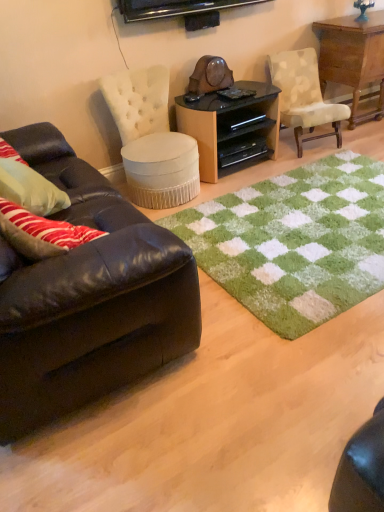
The width and height of the screenshot is (384, 512). I want to click on vacant space underneath beige fabric chair at upper right, which is the 1th chair in right-to-left order (from a real-world perspective), so click(309, 147).